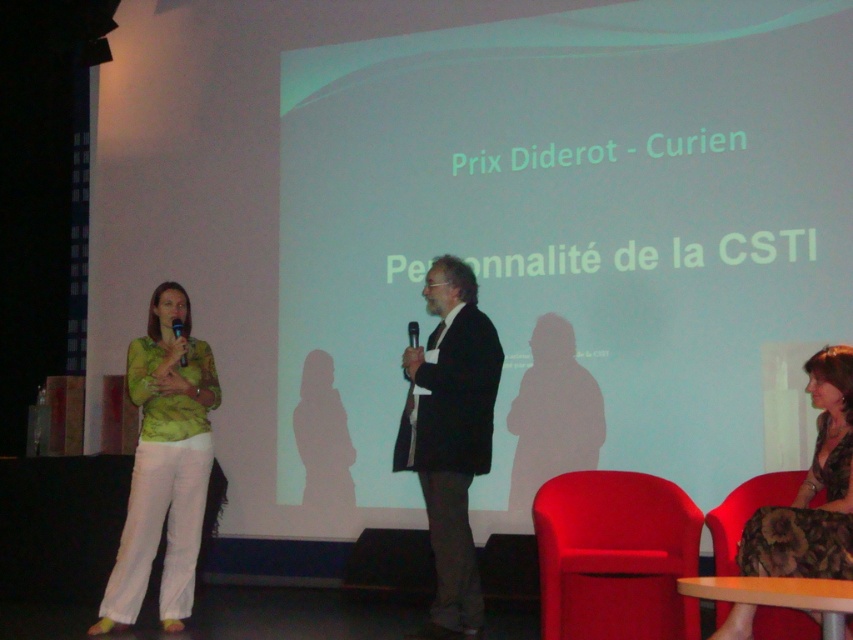
Question: Estimate the real-world distances between objects in this image. Which object is closer to the green matte shirt at left?

Choices:
 (A) matte black microphone at left
 (B) matte red chair at lower right
 (C) velvet brown dress at lower right
 (D) dark brown suit at center

Answer: (A)

Question: Which point is farther to the camera?

Choices:
 (A) velvet brown dress at lower right
 (B) green matte shirt at left
 (C) matte red chair at lower right

Answer: (B)

Question: Among these objects, which one is farthest from the camera?

Choices:
 (A) matte black microphone at left
 (B) matte red chair at lower right
 (C) velvet brown dress at lower right
 (D) dark brown suit at center

Answer: (A)

Question: Can you confirm if matte red chair at lower right is positioned above matte black microphone at left?

Choices:
 (A) no
 (B) yes

Answer: (A)

Question: Does dark brown suit at center appear under velvet brown dress at lower right?

Choices:
 (A) yes
 (B) no

Answer: (B)

Question: Does green matte shirt at left have a lesser width compared to velvet brown dress at lower right?

Choices:
 (A) yes
 (B) no

Answer: (A)